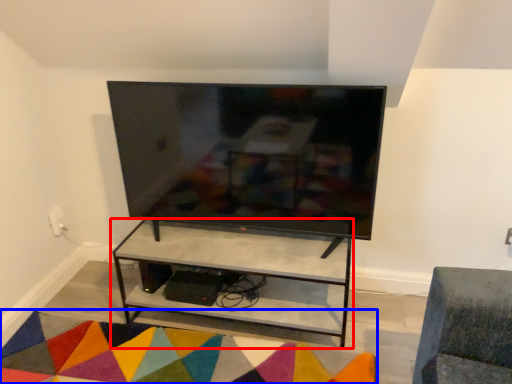
Question: Which point is further to the camera, shelf (highlighted by a red box) or mat (highlighted by a blue box)?

Choices:
 (A) shelf
 (B) mat

Answer: (A)